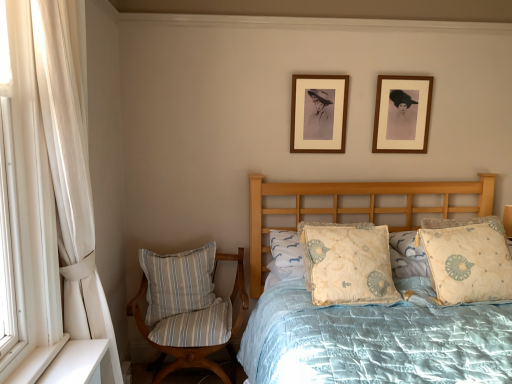
The image size is (512, 384). What do you see at coordinates (319, 113) in the screenshot?
I see `matte brown picture frame at upper center, the second picture frame from the right` at bounding box center [319, 113].

Locate an element on the screen. The image size is (512, 384). light beige fabric pillow at center, acting as the 3th pillow starting from the left is located at coordinates (348, 265).

I want to click on light blue quilted bed at center, so [x=352, y=207].

You are a GUI agent. You are given a task and a screenshot of the screen. Output one action in this format:
    pyautogui.click(x=<x>, y=<y>)
    Task: Click on the striped fabric chair at left
    Image resolution: width=512 pixels, height=384 pixels.
    Given the screenshot: What is the action you would take?
    (188, 309)

From the image's perspective, which one is positioned lower, striped fabric chair at left or light beige fabric pillow at center, which is the second pillow in right-to-left order?

striped fabric chair at left appears lower in the image.

The width and height of the screenshot is (512, 384). I want to click on chair below the light beige fabric pillow at center, which is the second pillow in right-to-left order (from the image's perspective), so click(x=188, y=309).

From a real-world perspective, which object rests below the other?

In real-world perspective, striped fabric chair at left is lower.

Is the depth of striped fabric chair at left less than that of light beige fabric pillow at center, acting as the 3th pillow starting from the left?

No, striped fabric chair at left is further to the viewer.

This screenshot has height=384, width=512. I want to click on picture frame that is the 2nd object located behind the white fabric curtain at left, so click(402, 114).

Can you tell me how much white fabric curtain at left and wooden picture frame at upper right, positioned as the first picture frame in right-to-left order, differ in facing direction?

There is a 90.7-degree angle between the facing directions of white fabric curtain at left and wooden picture frame at upper right, positioned as the first picture frame in right-to-left order.

Is white fabric curtain at left behind wooden picture frame at upper right, positioned as the first picture frame in right-to-left order?

That is False.

How far apart are white fabric curtain at left and wooden picture frame at upper right, the second picture frame positioned from the left?

white fabric curtain at left is 6.14 feet away from wooden picture frame at upper right, the second picture frame positioned from the left.

Looking at this image, is the surface of light blue quilted bed at center in direct contact with light beige fabric pillow at center, which is the 2th pillow in left-to-right order?

light blue quilted bed at center is not next to light beige fabric pillow at center, which is the 2th pillow in left-to-right order, and they're not touching.

Considering the sizes of light blue quilted bed at center and light beige fabric pillow at center, which is the 2th pillow in left-to-right order, in the image, is light blue quilted bed at center taller or shorter than light beige fabric pillow at center, which is the 2th pillow in left-to-right order,?

Considering their sizes, light blue quilted bed at center has more height than light beige fabric pillow at center, which is the 2th pillow in left-to-right order.

From the image's perspective, is light blue quilted bed at center on light beige fabric pillow at center, which is the 2th pillow in left-to-right order?

Incorrect, from the image's perspective, light blue quilted bed at center is lower than light beige fabric pillow at center, which is the 2th pillow in left-to-right order.

Is light blue quilted bed at center smaller than light beige fabric pillow at center, which is the 2th pillow in left-to-right order?

Actually, light blue quilted bed at center might be larger than light beige fabric pillow at center, which is the 2th pillow in left-to-right order.

Is striped fabric pillow at lower left, which is the 1th pillow in left-to-right order, aimed at light beige fabric pillow at center, the third pillow positioned from the right?

No, striped fabric pillow at lower left, which is the 1th pillow in left-to-right order, is not aimed at light beige fabric pillow at center, the third pillow positioned from the right.

From the image's perspective, is striped fabric pillow at lower left, which is the 1th pillow in left-to-right order, beneath light beige fabric pillow at center, which is the 2th pillow in left-to-right order?

Indeed, from the image's perspective, striped fabric pillow at lower left, which is the 1th pillow in left-to-right order, is shown beneath light beige fabric pillow at center, which is the 2th pillow in left-to-right order.

From a real-world perspective, relative to light beige fabric pillow at center, the third pillow positioned from the right, is striped fabric pillow at lower left, which appears as the 4th pillow when viewed from the right, vertically above or below?

striped fabric pillow at lower left, which appears as the 4th pillow when viewed from the right, is below light beige fabric pillow at center, the third pillow positioned from the right.

Considering the relative sizes of striped fabric pillow at lower left, which is the 1th pillow in left-to-right order, and light beige fabric pillow at center, which is the 2th pillow in left-to-right order, in the image provided, is striped fabric pillow at lower left, which is the 1th pillow in left-to-right order, wider than light beige fabric pillow at center, which is the 2th pillow in left-to-right order,?

In fact, striped fabric pillow at lower left, which is the 1th pillow in left-to-right order, might be narrower than light beige fabric pillow at center, which is the 2th pillow in left-to-right order.

From the picture: From a real-world perspective, which is physically above, striped fabric chair at left or beige floral pillow at right, which is the 1th pillow in right-to-left order?

In real-world perspective, beige floral pillow at right, which is the 1th pillow in right-to-left order, is above.

How different are the orientations of striped fabric chair at left and beige floral pillow at right, positioned as the fourth pillow in left-to-right order, in degrees?

6.59 degrees.

Consider the image. From the image's perspective, is striped fabric chair at left below beige floral pillow at right, positioned as the fourth pillow in left-to-right order?

Correct, striped fabric chair at left appears lower than beige floral pillow at right, positioned as the fourth pillow in left-to-right order, in the image.

Is striped fabric chair at left bigger than beige floral pillow at right, which is the 1th pillow in right-to-left order?

Yes.

Which is in front, point (320, 141) or point (495, 271)?

The point (495, 271) is closer.

From the image's perspective, is matte brown picture frame at upper center, the second picture frame from the right, located above or below beige floral pillow at right, which is the 1th pillow in right-to-left order?

Based on their image positions, matte brown picture frame at upper center, the second picture frame from the right, is located above beige floral pillow at right, which is the 1th pillow in right-to-left order.

Find the location of a particular element. the 3rd pillow to the right of the matte brown picture frame at upper center, the second picture frame from the right, counting from the anchor's position is located at coordinates (468, 263).

Considering the relative sizes of matte brown picture frame at upper center, the second picture frame from the right, and beige floral pillow at right, positioned as the fourth pillow in left-to-right order, in the image provided, is matte brown picture frame at upper center, the second picture frame from the right, smaller than beige floral pillow at right, positioned as the fourth pillow in left-to-right order,?

Indeed, matte brown picture frame at upper center, the second picture frame from the right, has a smaller size compared to beige floral pillow at right, positioned as the fourth pillow in left-to-right order.

Considering the relative positions of white fabric curtain at left and light beige fabric pillow at center, which is the 2th pillow in left-to-right order, in the image provided, is white fabric curtain at left to the right of light beige fabric pillow at center, which is the 2th pillow in left-to-right order, from the viewer's perspective?

No, white fabric curtain at left is not to the right of light beige fabric pillow at center, which is the 2th pillow in left-to-right order.

Which of these two, white fabric curtain at left or light beige fabric pillow at center, the third pillow positioned from the right, stands taller?

white fabric curtain at left is taller.

What's the angular difference between white fabric curtain at left and light beige fabric pillow at center, which is the 2th pillow in left-to-right order,'s facing directions?

The facing directions of white fabric curtain at left and light beige fabric pillow at center, which is the 2th pillow in left-to-right order, are 91.1 degrees apart.

Find the location of `the 2nd pillow counting from the right side of the white fabric curtain at left`. the 2nd pillow counting from the right side of the white fabric curtain at left is located at coordinates (296, 249).

This screenshot has width=512, height=384. I want to click on the 2nd pillow to the right of the striped fabric chair at left, starting your count from the anchor, so (348, 265).

Identify the location of curtain below the wooden picture frame at upper right, positioned as the first picture frame in right-to-left order (from the image's perspective). (49, 207).

Based on their spatial positions, is matte brown picture frame at upper center, the second picture frame from the right, or beige floral pillow at right, positioned as the fourth pillow in left-to-right order, further from wooden picture frame at upper right, positioned as the first picture frame in right-to-left order?

beige floral pillow at right, positioned as the fourth pillow in left-to-right order, lies further to wooden picture frame at upper right, positioned as the first picture frame in right-to-left order, than the other object.

In the scene shown: Based on their spatial positions, is light beige fabric pillow at center, which is the second pillow in right-to-left order, or wooden picture frame at upper right, positioned as the first picture frame in right-to-left order, closer to light beige fabric pillow at center, which is the 2th pillow in left-to-right order?

The object closer to light beige fabric pillow at center, which is the 2th pillow in left-to-right order, is light beige fabric pillow at center, which is the second pillow in right-to-left order.

Considering their positions, is light beige fabric pillow at center, the third pillow positioned from the right, positioned closer to white fabric curtain at left than beige floral pillow at right, which is the 1th pillow in right-to-left order?

light beige fabric pillow at center, the third pillow positioned from the right, is closer to white fabric curtain at left.

In the scene shown: Considering their positions, is white fabric curtain at left positioned closer to wooden picture frame at upper right, the second picture frame positioned from the left, than striped fabric chair at left?

striped fabric chair at left is positioned closer to the anchor wooden picture frame at upper right, the second picture frame positioned from the left.

Estimate the real-world distances between objects in this image. Which object is closer to light blue quilted bed at center, light beige fabric pillow at center, acting as the 3th pillow starting from the left, or light beige fabric pillow at center, the third pillow positioned from the right?

light beige fabric pillow at center, the third pillow positioned from the right.

From the image, which object appears to be nearer to striped fabric pillow at lower left, which appears as the 4th pillow when viewed from the right, white fabric curtain at left or light blue quilted bed at center?

Based on the image, light blue quilted bed at center appears to be nearer to striped fabric pillow at lower left, which appears as the 4th pillow when viewed from the right.

Based on the photo, considering their positions, is matte brown picture frame at upper center, which is the first picture frame from left to right, positioned further to light beige fabric pillow at center, which is the 2th pillow in left-to-right order, than striped fabric chair at left?

The object further to light beige fabric pillow at center, which is the 2th pillow in left-to-right order, is matte brown picture frame at upper center, which is the first picture frame from left to right.

Looking at the image, which one is located further to striped fabric pillow at lower left, which appears as the 4th pillow when viewed from the right, light beige fabric pillow at center, which is the second pillow in right-to-left order, or beige floral pillow at right, positioned as the fourth pillow in left-to-right order?

Based on the image, beige floral pillow at right, positioned as the fourth pillow in left-to-right order, appears to be further to striped fabric pillow at lower left, which appears as the 4th pillow when viewed from the right.

This screenshot has height=384, width=512. I want to click on chair located between white fabric curtain at left and striped fabric pillow at lower left, which is the 1th pillow in left-to-right order, in the depth direction, so click(x=188, y=309).

This screenshot has height=384, width=512. Find the location of `pillow between wooden picture frame at upper right, the second picture frame positioned from the left, and light beige fabric pillow at center, the third pillow positioned from the right, in the up-down direction`. pillow between wooden picture frame at upper right, the second picture frame positioned from the left, and light beige fabric pillow at center, the third pillow positioned from the right, in the up-down direction is located at coordinates (468, 263).

Locate an element on the screen. This screenshot has height=384, width=512. pillow between striped fabric chair at left and light beige fabric pillow at center, acting as the 3th pillow starting from the left is located at coordinates (296, 249).

Locate an element on the screen. pillow between striped fabric pillow at lower left, which appears as the 4th pillow when viewed from the right, and light beige fabric pillow at center, acting as the 3th pillow starting from the left, in the horizontal direction is located at coordinates (296, 249).